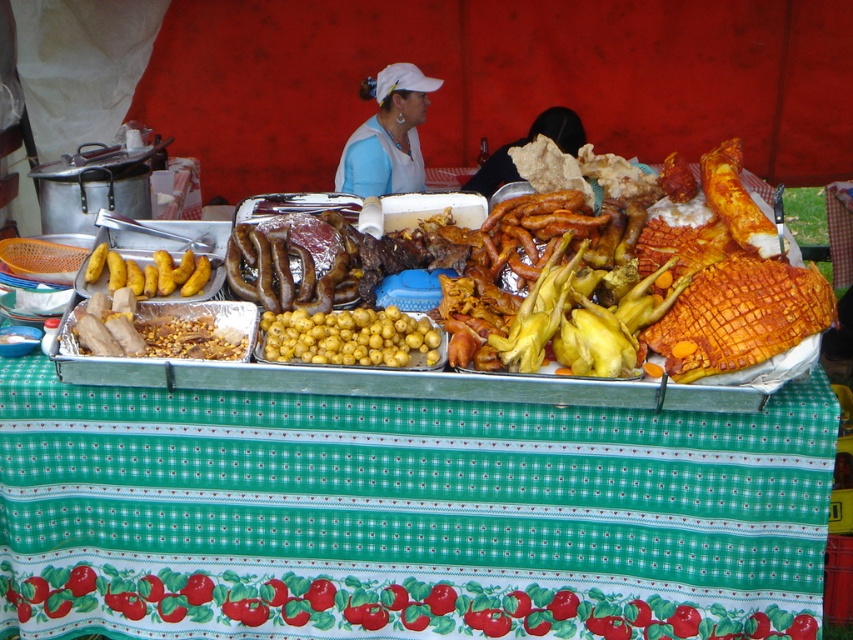
Between green glossy tomato at lower center and yellow matte potatoes at center, which one is positioned higher?

yellow matte potatoes at center is higher up.

Identify the location of green glossy tomato at lower center. Image resolution: width=853 pixels, height=640 pixels. (368, 600).

Who is more distant from viewer, (532, 616) or (399, 312)?

The point (532, 616) is more distant.

This screenshot has height=640, width=853. What are the coordinates of `green glossy tomato at lower center` in the screenshot? It's located at (368, 600).

Which of these two, green glossy tomato at lower center or white fabric at center, stands taller?

white fabric at center is taller.

In the scene shown: Can you confirm if green glossy tomato at lower center is shorter than white fabric at center?

Correct, green glossy tomato at lower center is not as tall as white fabric at center.

The height and width of the screenshot is (640, 853). What do you see at coordinates (368, 600) in the screenshot? I see `green glossy tomato at lower center` at bounding box center [368, 600].

At what (x,y) coordinates should I click in order to perform the action: click on green glossy tomato at lower center. Please return your answer as a coordinate pair (x, y). Looking at the image, I should click on (368, 600).

Between yellow matte potatoes at center and black fabric at upper center, which one is positioned higher?

black fabric at upper center is above.

From the picture: Does yellow matte potatoes at center have a smaller size compared to black fabric at upper center?

Indeed, yellow matte potatoes at center has a smaller size compared to black fabric at upper center.

Who is more distant from viewer, (421, 349) or (532, 138)?

Positioned behind is point (532, 138).

This screenshot has height=640, width=853. What are the coordinates of `yellow matte potatoes at center` in the screenshot? It's located at (347, 337).